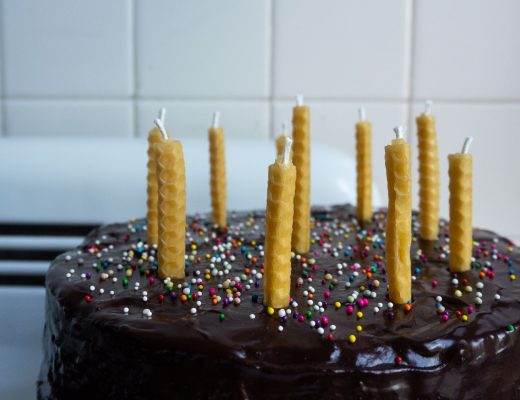
Identify the location of candle. The height and width of the screenshot is (400, 520). pyautogui.click(x=153, y=162), pyautogui.click(x=153, y=381), pyautogui.click(x=180, y=200), pyautogui.click(x=216, y=172), pyautogui.click(x=273, y=213), pyautogui.click(x=302, y=196), pyautogui.click(x=402, y=181), pyautogui.click(x=425, y=172), pyautogui.click(x=456, y=203).